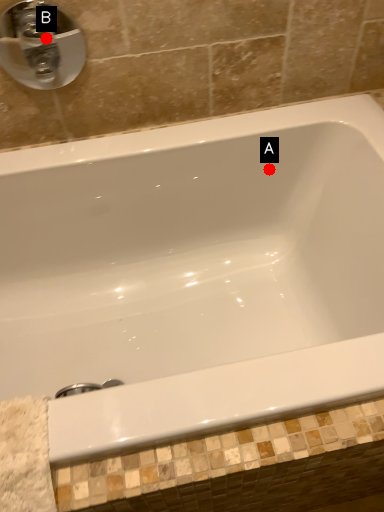
Question: Two points are circled on the image, labeled by A and B beside each circle. Which point is farther to the camera?

Choices:
 (A) A is further
 (B) B is further

Answer: (A)